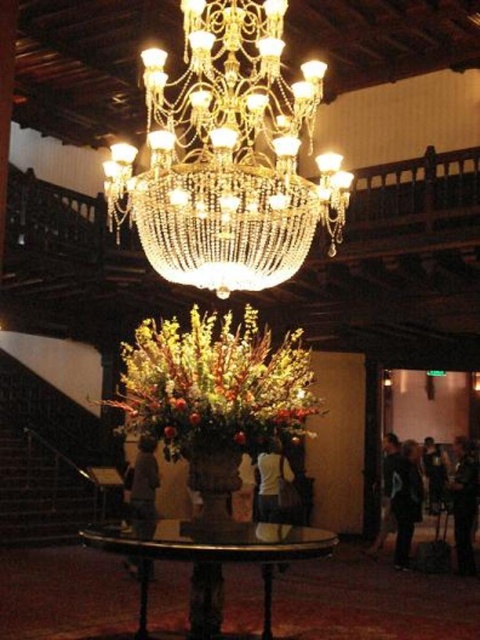
Question: Is shiny metallic vase at center smaller than light brown leather jacket at center?

Choices:
 (A) no
 (B) yes

Answer: (B)

Question: Which of the following is the closest to the observer?

Choices:
 (A) gold crystal chandelier at center
 (B) shiny metallic vase at center
 (C) dark blue jeans at lower right

Answer: (A)

Question: Can you confirm if dark blue fabric at lower right is smaller than dark blue jeans at lower right?

Choices:
 (A) no
 (B) yes

Answer: (B)

Question: Which of the following is the closest to the observer?

Choices:
 (A) (460, 468)
 (B) (404, 525)
 (C) (164, 384)
 (D) (149, 499)

Answer: (C)

Question: Which object is farther from the camera taking this photo?

Choices:
 (A) light brown leather jacket at center
 (B) shiny metallic vase at center
 (C) glass/metallic table at center
 (D) dark blue jeans at lower right

Answer: (D)

Question: Does light brown leather jacket at center lie behind white matte shirt at center?

Choices:
 (A) yes
 (B) no

Answer: (B)